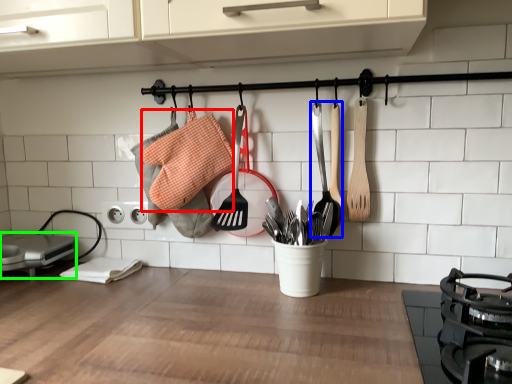
Question: Considering the real-world distances, which object is closest to material (highlighted by a red box)? spatula (highlighted by a blue box) or appliance (highlighted by a green box).

Choices:
 (A) spatula
 (B) appliance

Answer: (A)